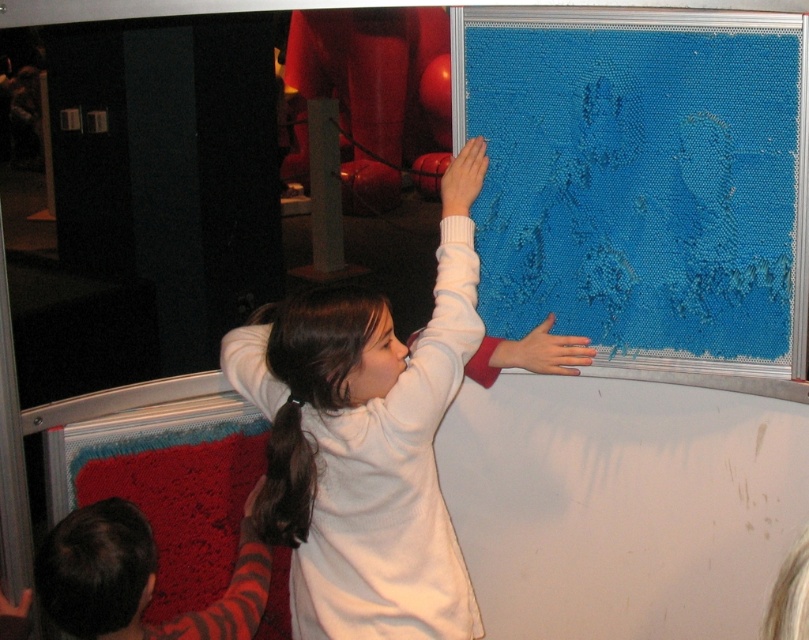
Can you confirm if blue textured fabric at upper right is positioned to the left of white matte sweater at upper center?

Incorrect, blue textured fabric at upper right is not on the left side of white matte sweater at upper center.

Does blue textured fabric at upper right have a lesser width compared to white matte sweater at upper center?

No, blue textured fabric at upper right is not thinner than white matte sweater at upper center.

Which is in front, point (545, 74) or point (455, 236)?

Point (455, 236)

Image resolution: width=809 pixels, height=640 pixels. I want to click on blue textured fabric at upper right, so tap(642, 179).